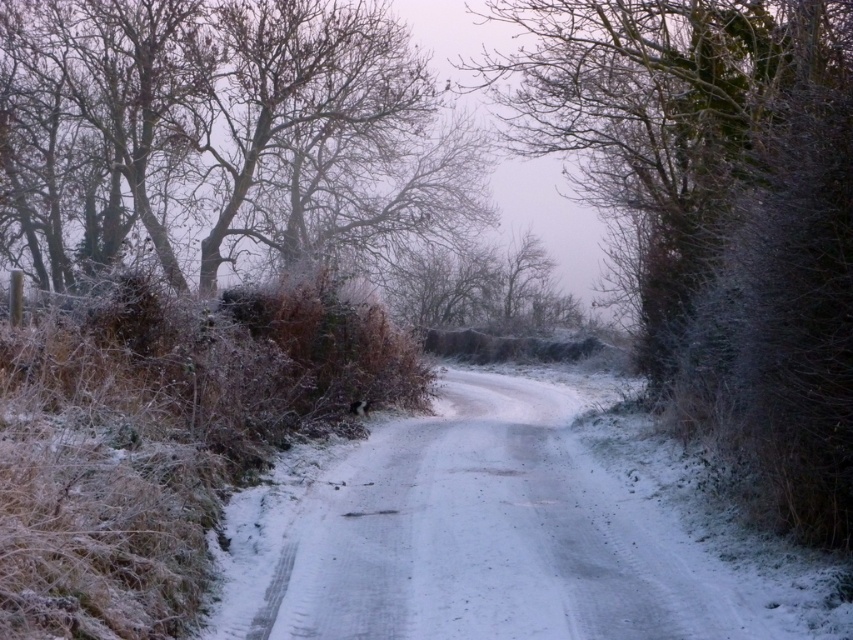
Question: Which point is farther to the camera?

Choices:
 (A) (788, 262)
 (B) (436, 115)

Answer: (B)

Question: Does frosty bark tree at center appear on the left side of snow-covered branches at upper left?

Choices:
 (A) no
 (B) yes

Answer: (A)

Question: Can you confirm if frosty bark tree at center is positioned to the left of snow-covered branches at upper left?

Choices:
 (A) no
 (B) yes

Answer: (A)

Question: Which point is farther to the camera?

Choices:
 (A) frosty bark tree at center
 (B) snow-covered branches at upper left

Answer: (B)

Question: Can you confirm if frosty bark tree at center is positioned to the left of snow-covered branches at upper left?

Choices:
 (A) yes
 (B) no

Answer: (B)